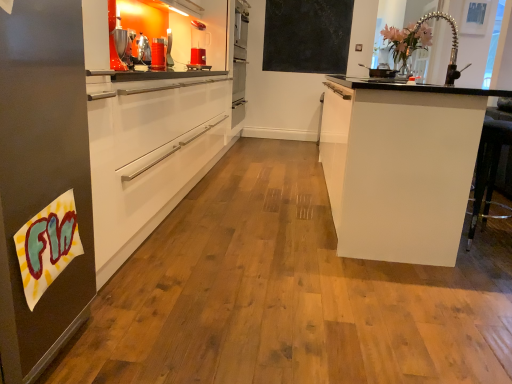
Question: Considering the positions of translucent plastic pitcher at center and matte black chalkboard at upper center in the image, is translucent plastic pitcher at center bigger or smaller than matte black chalkboard at upper center?

Choices:
 (A) small
 (B) big

Answer: (A)

Question: Is translucent plastic pitcher at center taller or shorter than matte black chalkboard at upper center?

Choices:
 (A) tall
 (B) short

Answer: (B)

Question: Which of these objects is positioned closest to the matte black chalkboard at upper center?

Choices:
 (A) metallic silver coffee machine at upper left
 (B) white glossy cabinet at right
 (C) translucent plastic pitcher at center

Answer: (C)

Question: Estimate the real-world distances between objects in this image. Which object is closer to the white glossy cabinet at right?

Choices:
 (A) metallic silver coffee machine at upper left
 (B) matte black chalkboard at upper center
 (C) translucent plastic pitcher at center

Answer: (A)